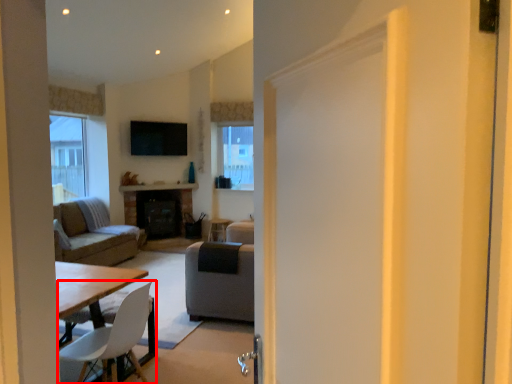
Question: Considering the relative positions of chair (annotated by the red box) and studio couch in the image provided, where is chair (annotated by the red box) located with respect to the staircase?

Choices:
 (A) left
 (B) right

Answer: (B)